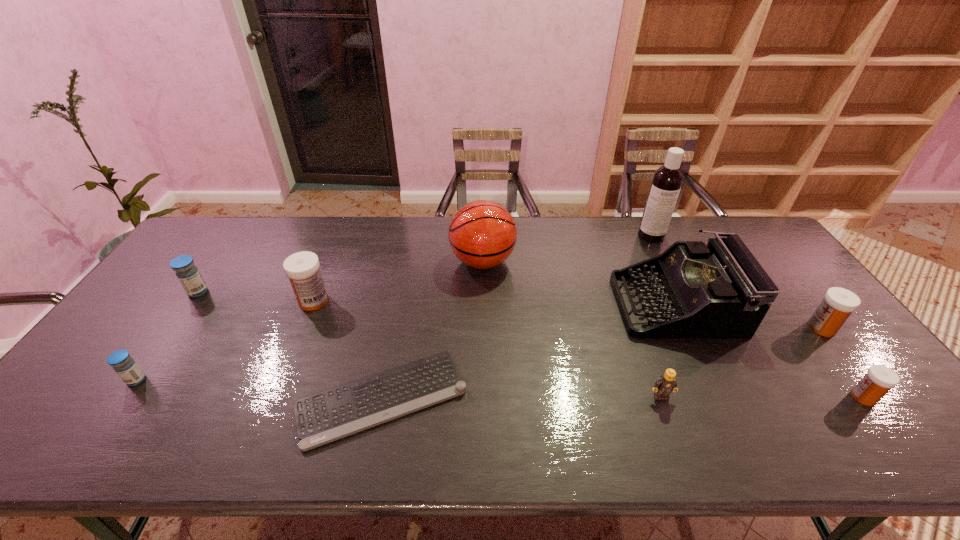
Locate an element on the screen. vacant space at the far edge of the desktop is located at coordinates (548, 241).

You are a GUI agent. You are given a task and a screenshot of the screen. Output one action in this format:
    pyautogui.click(x=<x>, y=<y>)
    Task: Click on the blank space at the near edge
    Image resolution: width=960 pixels, height=540 pixels.
    Given the screenshot: What is the action you would take?
    pyautogui.click(x=487, y=422)

The height and width of the screenshot is (540, 960). In the image, there is a desktop. Identify the location of vacant space at the left edge. (101, 376).

At what (x,y) coordinates should I click in order to perform the action: click on vacant space at the far left corner of the desktop. Please return your answer as a coordinate pair (x, y). Looking at the image, I should click on (214, 233).

Identify the location of vacant area that lies between the tallest object and the nearer blue medicine. (394, 308).

Locate an element on the screen. This screenshot has height=540, width=960. free space between the typewriter and the basketball is located at coordinates (579, 282).

Find the location of `vacant space that's between the nearest white medicine and the black typewriter`. vacant space that's between the nearest white medicine and the black typewriter is located at coordinates (770, 350).

Identify the location of unoccupied position between the ninth shortest object and the smaller blue medicine. (309, 321).

Identify the location of free space between the tan Lego and the shortest object. (521, 397).

Find the location of a particular element. This screenshot has height=540, width=960. vacant area between the Lego and the computer keyboard is located at coordinates (521, 397).